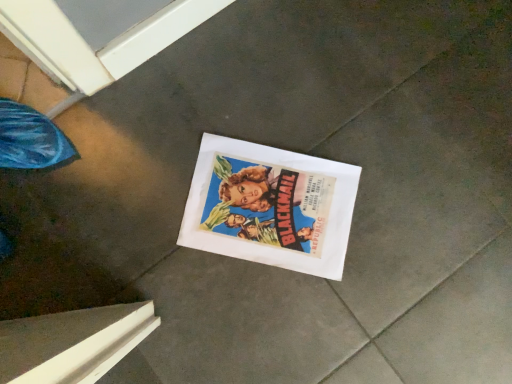
The height and width of the screenshot is (384, 512). What do you see at coordinates (270, 206) in the screenshot?
I see `matte paper flyer at center` at bounding box center [270, 206].

Locate an element on the screen. matte paper flyer at center is located at coordinates (270, 206).

Measure the distance between matte paper flyer at center and camera.

matte paper flyer at center and camera are 29.41 inches apart from each other.

Locate an element on the screen. The width and height of the screenshot is (512, 384). matte paper flyer at center is located at coordinates (270, 206).